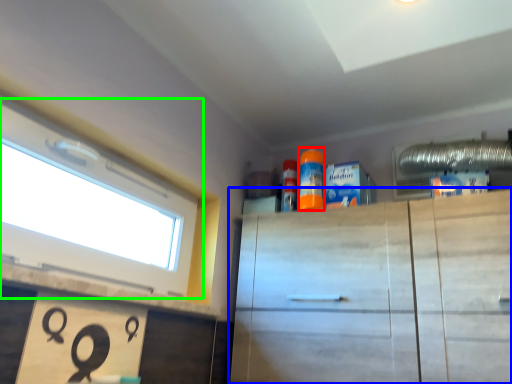
Question: Based on their relative distances, which object is nearer to cleaning product (highlighted by a red box)? Choose from cabinetry (highlighted by a blue box) and window (highlighted by a green box).

Choices:
 (A) cabinetry
 (B) window

Answer: (A)